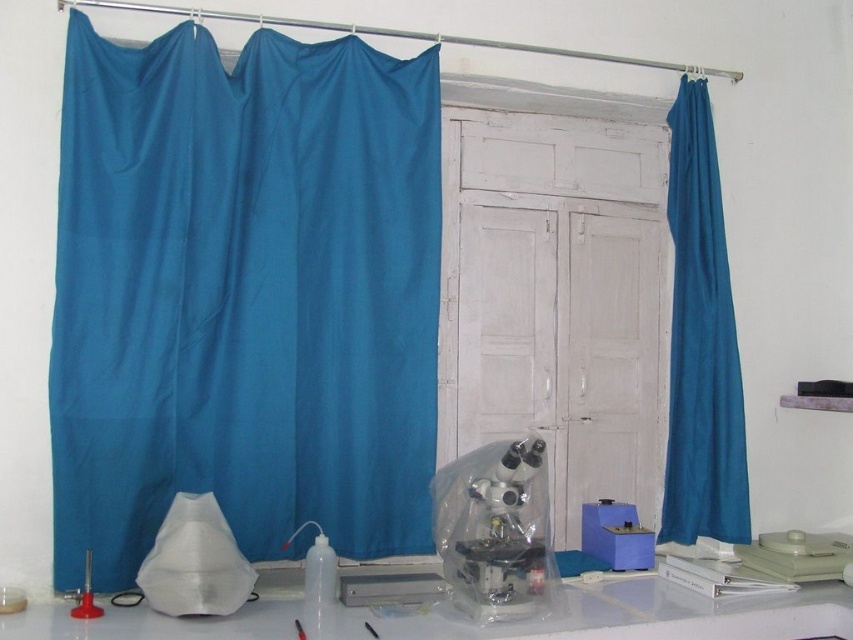
You are a researcher who needs to move the clear plastic microscope at center to the left side of the matte red stand at lower left. Can you do this without moving the matte red stand?

The clear plastic microscope at center is currently positioned on the right side of the matte red stand at lower left, so moving it to the left side would require shifting it to the opposite side of the stand. Since the question allows moving the microscope without moving the stand, this is possible as long as there is enough space on the left side of the stand to place the microscope.

You are setting up a lab and need to choose between placing a large equipment box on either the teal fabric curtain at left or the white plastic table at lower center. Based on their sizes, which surface would be more suitable for the box?

The teal fabric curtain at left is larger in size than the white plastic table at lower center, so the teal fabric curtain at left would be more suitable for placing the large equipment box.